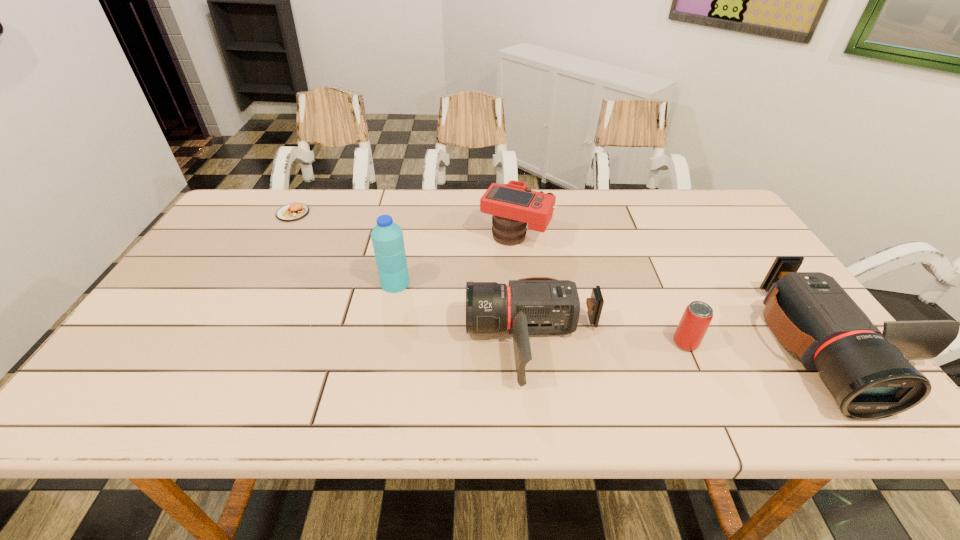
With all camcorders evenly spaced, where should an extra camcorder be placed on the left to continue the pattern? Please point out a vacant space. Please provide its 2D coordinates. Your answer should be formatted as a tuple, i.e. [(x, y)], where the tuple contains the x and y coordinates of a point satisfying the conditions above.

[(239, 336)]